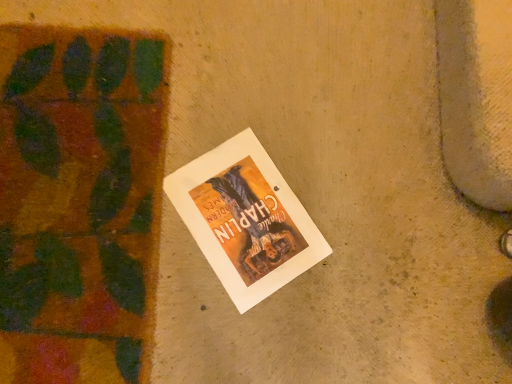
Locate an element on the screen. vacant space behind green leafy plant at left is located at coordinates (205, 44).